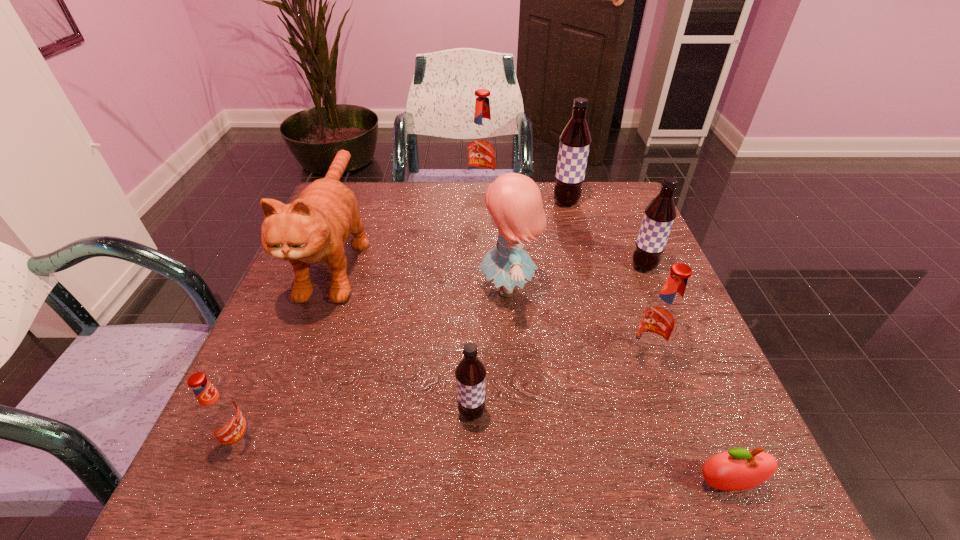
The width and height of the screenshot is (960, 540). Find the location of `free space that is in between the fourth nearest root beer and the blue doll`. free space that is in between the fourth nearest root beer and the blue doll is located at coordinates pyautogui.click(x=576, y=278).

Where is `object that stands as the second closest to the rightmost root beer`? object that stands as the second closest to the rightmost root beer is located at coordinates (575, 140).

Find the location of a particular element. The width and height of the screenshot is (960, 540). object that can be found as the third closest to the doll is located at coordinates (575, 140).

Identify which root beer is the fifth closest to the orange cat. Please provide its 2D coordinates. Your answer should be formatted as a tuple, i.e. [(x, y)], where the tuple contains the x and y coordinates of a point satisfying the conditions above.

[(662, 319)]

At what (x,y) coordinates should I click in order to perform the action: click on root beer that is the fifth closest to the second farthest brown root beer. Please return your answer as a coordinate pair (x, y). This screenshot has height=540, width=960. Looking at the image, I should click on (220, 414).

Identify the location of the closest red root beer relative to the nearest object. This screenshot has height=540, width=960. (662, 319).

This screenshot has height=540, width=960. Find the location of `red root beer that is the closest to the rightmost red root beer`. red root beer that is the closest to the rightmost red root beer is located at coordinates (482, 147).

Locate which brown root beer is the closest to the apple. Please provide its 2D coordinates. Your answer should be formatted as a tuple, i.e. [(x, y)], where the tuple contains the x and y coordinates of a point satisfying the conditions above.

[(470, 373)]

Image resolution: width=960 pixels, height=540 pixels. What are the coordinates of `the closest brown root beer to the blue doll` in the screenshot? It's located at (470, 373).

The height and width of the screenshot is (540, 960). I want to click on vacant space that satisfies the following two spatial constraints: 1. on the front side of the nearest object; 2. on the left side of the nearest root beer, so click(222, 484).